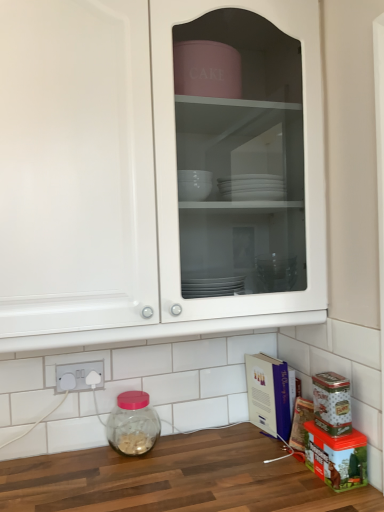
Question: Is white glossy cabinet at upper center inside white plastic electric outlet at lower left?

Choices:
 (A) yes
 (B) no

Answer: (B)

Question: Is white plastic electric outlet at lower left far away from white glossy cabinet at upper center?

Choices:
 (A) yes
 (B) no

Answer: (B)

Question: From a real-world perspective, is white plastic electric outlet at lower left physically above white glossy cabinet at upper center?

Choices:
 (A) no
 (B) yes

Answer: (A)

Question: Is white plastic electric outlet at lower left not within white glossy cabinet at upper center?

Choices:
 (A) yes
 (B) no

Answer: (A)

Question: Considering the relative positions of white plastic electric outlet at lower left and white glossy cabinet at upper center in the image provided, is white plastic electric outlet at lower left behind white glossy cabinet at upper center?

Choices:
 (A) yes
 (B) no

Answer: (A)

Question: Is point (253, 418) positioned closer to the camera than point (56, 370)?

Choices:
 (A) farther
 (B) closer

Answer: (A)

Question: Looking at the image, does cardboard box at lower right seem bigger or smaller compared to white plastic electric outlet at lower left?

Choices:
 (A) big
 (B) small

Answer: (A)

Question: Based on their positions, is cardboard box at lower right located to the left or right of white plastic electric outlet at lower left?

Choices:
 (A) left
 (B) right

Answer: (B)

Question: From the image's perspective, is cardboard box at lower right positioned above or below white plastic electric outlet at lower left?

Choices:
 (A) below
 (B) above

Answer: (A)

Question: Is point (316, 26) closer or farther from the camera than point (152, 417)?

Choices:
 (A) farther
 (B) closer

Answer: (B)

Question: In terms of width, does white glossy cabinet at upper center look wider or thinner when compared to transparent glass jar at lower left?

Choices:
 (A) wide
 (B) thin

Answer: (A)

Question: Is white glossy cabinet at upper center situated inside transparent glass jar at lower left or outside?

Choices:
 (A) outside
 (B) inside

Answer: (A)

Question: From the image's perspective, is white glossy cabinet at upper center above or below transparent glass jar at lower left?

Choices:
 (A) below
 (B) above

Answer: (B)

Question: From a real-world perspective, relative to transparent glass jar at lower left, is cardboard box at lower right vertically above or below?

Choices:
 (A) above
 (B) below

Answer: (A)

Question: From the image's perspective, is cardboard box at lower right above or below transparent glass jar at lower left?

Choices:
 (A) above
 (B) below

Answer: (A)